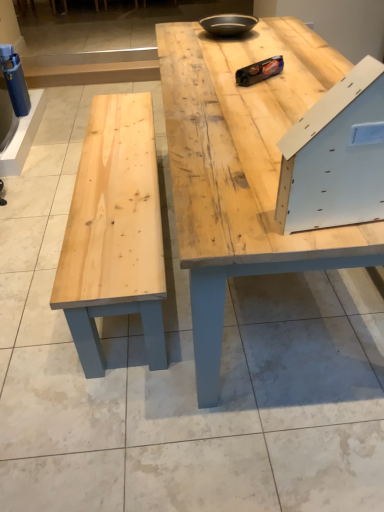
The width and height of the screenshot is (384, 512). What are the coordinates of `vacant position to the left of white matte drawer at upper right` in the screenshot? It's located at (248, 215).